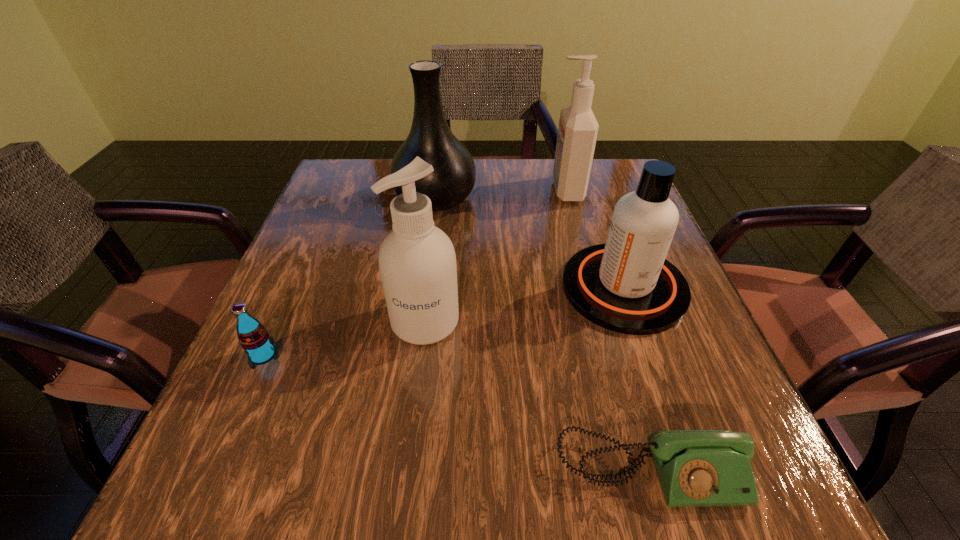
Locate an element on the screen. Image resolution: width=960 pixels, height=540 pixels. object that is at the far right corner is located at coordinates (577, 133).

Locate an element on the screen. The height and width of the screenshot is (540, 960). object located in the near right corner section of the desktop is located at coordinates (696, 468).

I want to click on vacant space at the far edge of the desktop, so click(522, 190).

The image size is (960, 540). In order to click on vacant space at the near edge in this screenshot , I will do tap(572, 498).

This screenshot has height=540, width=960. In order to click on vacant space at the left edge of the desktop in this screenshot , I will do click(331, 285).

At what (x,y) coordinates should I click in order to perform the action: click on free space at the right edge. Please return your answer as a coordinate pair (x, y). Looking at the image, I should click on (663, 377).

Locate an element on the screen. vacant space at the far right corner of the desktop is located at coordinates (618, 167).

Find the location of a particular element. The height and width of the screenshot is (540, 960). free space between the nearest object and the second shortest object is located at coordinates point(457,413).

This screenshot has height=540, width=960. What are the coordinates of `free space between the soda and the vase` in the screenshot? It's located at (349, 276).

At what (x,y) coordinates should I click in order to perform the action: click on vacant area between the telephone and the vase. Please return your answer as a coordinate pair (x, y). Looking at the image, I should click on (543, 334).